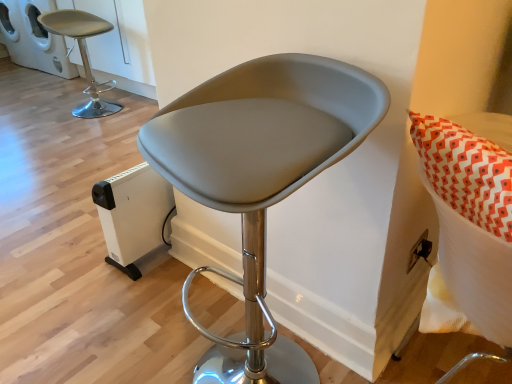
The image size is (512, 384). I want to click on free location to the left of matte gray stool at upper left, acting as the 2th chair starting from the front, so click(30, 121).